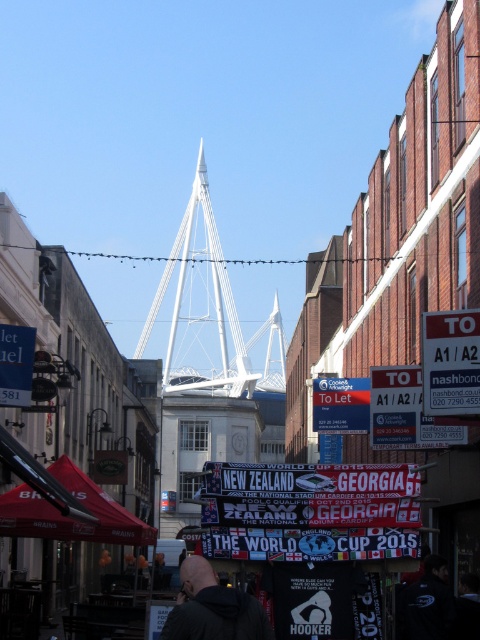
Between dark gray jacket at lower center and black fabric jacket at lower right, which one has more height?

With more height is dark gray jacket at lower center.

Does dark gray jacket at lower center come in front of black fabric jacket at lower right?

Yes, dark gray jacket at lower center is closer to the viewer.

Identify the location of dark gray jacket at lower center. (213, 609).

Can you confirm if white plastic sign at upper right is bigger than blue plastic sign at center?

No.

Is white plastic sign at upper right to the left of blue plastic sign at center from the viewer's perspective?

Incorrect, white plastic sign at upper right is not on the left side of blue plastic sign at center.

The image size is (480, 640). Describe the element at coordinates (451, 362) in the screenshot. I see `white plastic sign at upper right` at that location.

The width and height of the screenshot is (480, 640). Identify the location of white plastic sign at upper right. (451, 362).

Between point (230, 614) and point (330, 410), which one is positioned behind?

Positioned behind is point (330, 410).

Who is positioned more to the left, dark gray jacket at lower center or blue plastic sign at center?

dark gray jacket at lower center

Where is `dark gray jacket at lower center`? The image size is (480, 640). dark gray jacket at lower center is located at coordinates (213, 609).

I want to click on dark gray jacket at lower center, so click(213, 609).